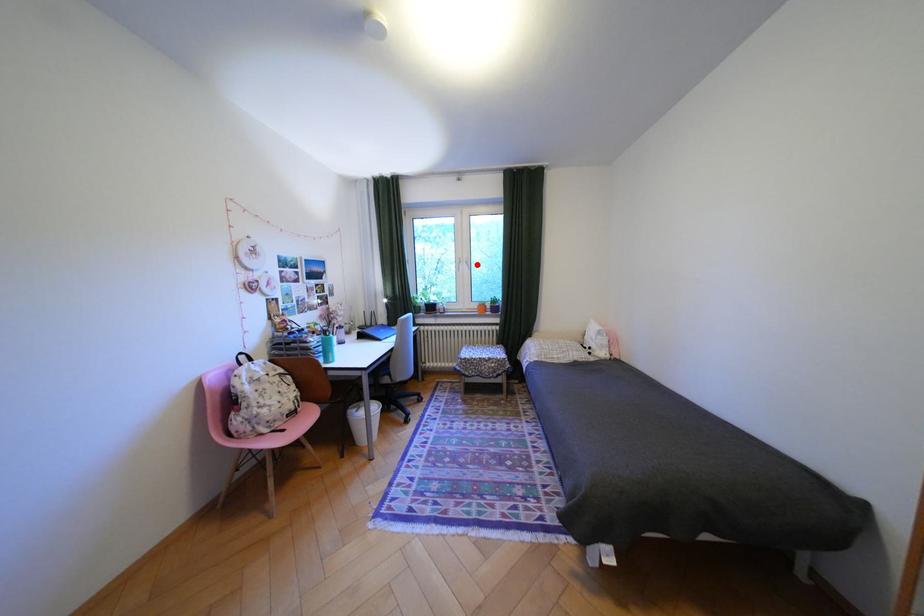
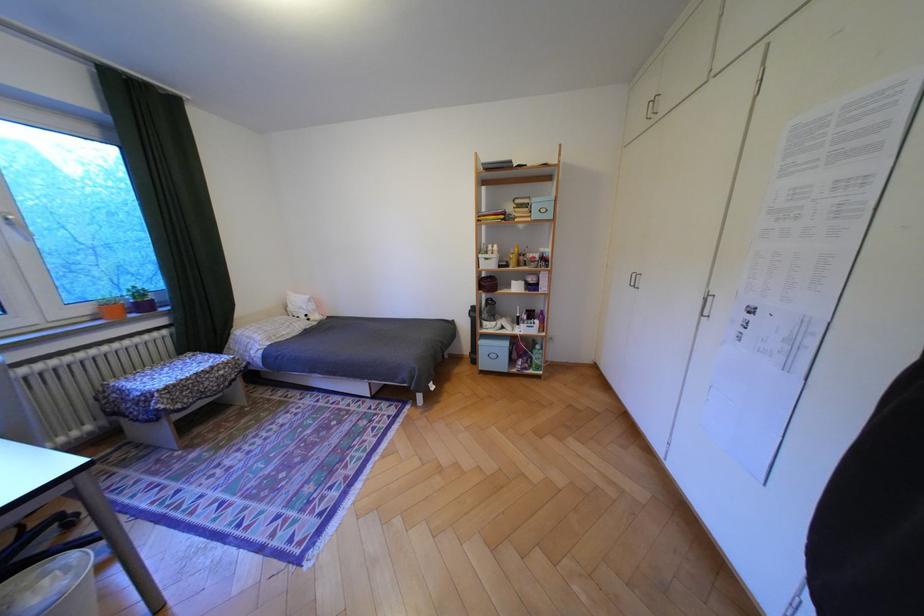
Where in the second image is the point corresponding to the highlighted location from the first image?

(18, 227)